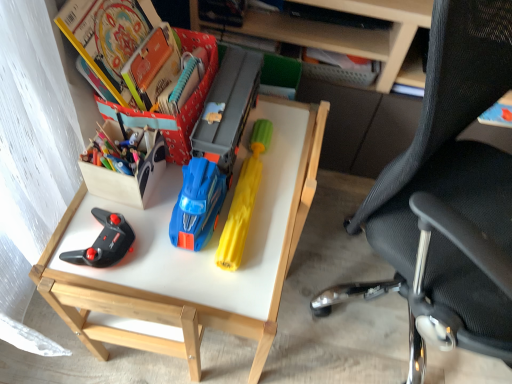
Question: From the image's perspective, would you say yellow rubber toy at center is positioned over wooden box at left?

Choices:
 (A) no
 (B) yes

Answer: (B)

Question: Does yellow rubber toy at center touch wooden box at left?

Choices:
 (A) no
 (B) yes

Answer: (A)

Question: Can you confirm if yellow rubber toy at center is thinner than wooden box at left?

Choices:
 (A) no
 (B) yes

Answer: (A)

Question: Is yellow rubber toy at center wider than wooden box at left?

Choices:
 (A) yes
 (B) no

Answer: (A)

Question: Is wooden box at left at the back of yellow rubber toy at center?

Choices:
 (A) yes
 (B) no

Answer: (B)

Question: In terms of height, does matte plastic desk at center look taller or shorter compared to matte paper book at upper left, the 3th book in the front-to-back sequence?

Choices:
 (A) tall
 (B) short

Answer: (A)

Question: Considering the relative positions of matte plastic desk at center and matte paper book at upper left, placed as the first book when sorted from back to front, in the image provided, is matte plastic desk at center to the left or to the right of matte paper book at upper left, placed as the first book when sorted from back to front,?

Choices:
 (A) right
 (B) left

Answer: (A)

Question: In the image, is matte plastic desk at center positioned in front of or behind matte paper book at upper left, placed as the first book when sorted from back to front?

Choices:
 (A) front
 (B) behind

Answer: (A)

Question: Based on their sizes in the image, would you say matte plastic desk at center is bigger or smaller than matte paper book at upper left, placed as the first book when sorted from back to front?

Choices:
 (A) small
 (B) big

Answer: (B)

Question: Is matte plastic desk at center taller or shorter than yellow rubber toy at center?

Choices:
 (A) short
 (B) tall

Answer: (B)

Question: In terms of size, does matte plastic desk at center appear bigger or smaller than yellow rubber toy at center?

Choices:
 (A) small
 (B) big

Answer: (B)

Question: From the image's perspective, is matte plastic desk at center located above or below yellow rubber toy at center?

Choices:
 (A) below
 (B) above

Answer: (A)

Question: Based on their positions, is matte plastic desk at center located to the left or right of yellow rubber toy at center?

Choices:
 (A) left
 (B) right

Answer: (A)

Question: Does point (134, 8) appear closer or farther from the camera than point (216, 57)?

Choices:
 (A) farther
 (B) closer

Answer: (B)

Question: Visually, is hardcover book at upper left, which is counted as the first book, starting from the front, positioned to the left or to the right of matte paper book at upper left, the 3th book in the front-to-back sequence?

Choices:
 (A) left
 (B) right

Answer: (A)